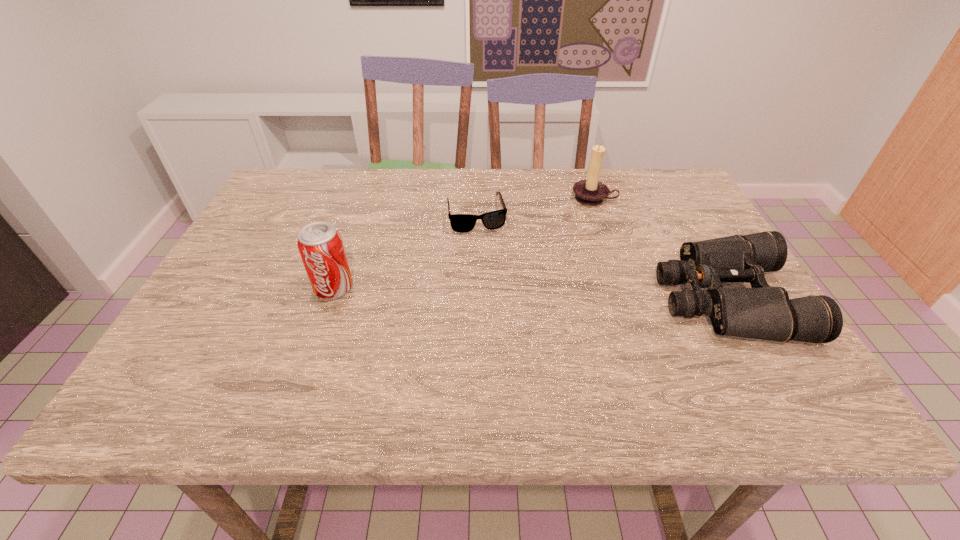
The width and height of the screenshot is (960, 540). What are the coordinates of `empty space between the second shortest object and the third object from left to right` in the screenshot? It's located at (660, 249).

The height and width of the screenshot is (540, 960). In order to click on blank region between the candle holder and the sunglasses in this screenshot , I will do coord(535,206).

Image resolution: width=960 pixels, height=540 pixels. Identify the location of vacant space in between the second shortest object and the third object from right to left. (601, 256).

Where is `free space between the third object from right to left and the leftmost object`? Image resolution: width=960 pixels, height=540 pixels. free space between the third object from right to left and the leftmost object is located at coordinates (405, 251).

Where is `free space between the leftmost object and the shortest object`? free space between the leftmost object and the shortest object is located at coordinates (405, 251).

Image resolution: width=960 pixels, height=540 pixels. Identify the location of free space between the rightmost object and the sunglasses. (601, 256).

You are a GUI agent. You are given a task and a screenshot of the screen. Output one action in this format:
    pyautogui.click(x=<x>, y=<y>)
    Task: Click on the free space between the binoculars and the soda can
    This screenshot has width=960, height=540.
    Given the screenshot: What is the action you would take?
    pyautogui.click(x=530, y=293)

Image resolution: width=960 pixels, height=540 pixels. Identify the location of object that ranks as the second closest to the shortest object. (320, 245).

Point out which object is positioned as the third nearest to the sunglasses. Please provide its 2D coordinates. Your answer should be formatted as a tuple, i.e. [(x, y)], where the tuple contains the x and y coordinates of a point satisfying the conditions above.

[(765, 312)]

This screenshot has width=960, height=540. I want to click on vacant region that satisfies the following two spatial constraints: 1. on the back side of the soda can; 2. on the right side of the third object from left to right, so click(365, 199).